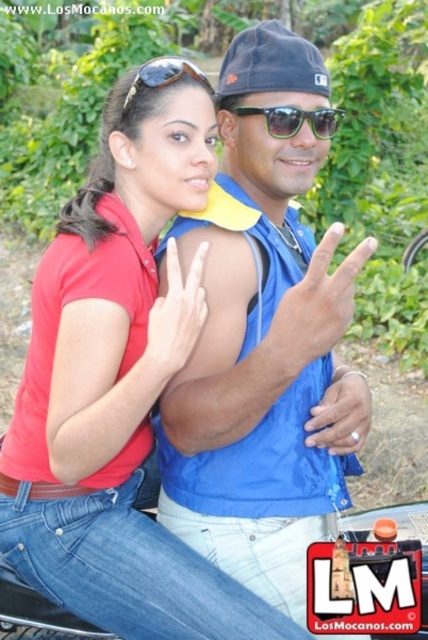
Who is higher up, blue fabric vest at center or sunglasses at center?

sunglasses at center

Is blue fabric vest at center bigger than sunglasses at center?

Correct, blue fabric vest at center is larger in size than sunglasses at center.

In order to click on blue fabric vest at center in this screenshot , I will do `click(261, 340)`.

The image size is (428, 640). Find the location of `blue fabric vest at center`. blue fabric vest at center is located at coordinates (261, 340).

Which of these two, matte red polo shirt at center or blue fabric vest at center, stands shorter?

Standing shorter between the two is matte red polo shirt at center.

Between matte red polo shirt at center and blue fabric vest at center, which one appears on the right side from the viewer's perspective?

Positioned to the right is blue fabric vest at center.

Between point (74, 339) and point (225, 264), which one is positioned in front?

Point (74, 339) is in front.

Where is `matte red polo shirt at center`? The image size is (428, 640). matte red polo shirt at center is located at coordinates (x=118, y=388).

Does sunglasses at center have a smaller size compared to matte black sunglasses at upper center?

No, sunglasses at center is not smaller than matte black sunglasses at upper center.

Which is more to the left, sunglasses at center or matte black sunglasses at upper center?

From the viewer's perspective, matte black sunglasses at upper center appears more on the left side.

Find the location of a particular element. sunglasses at center is located at coordinates (294, 120).

Where is `sunglasses at center`? sunglasses at center is located at coordinates (294, 120).